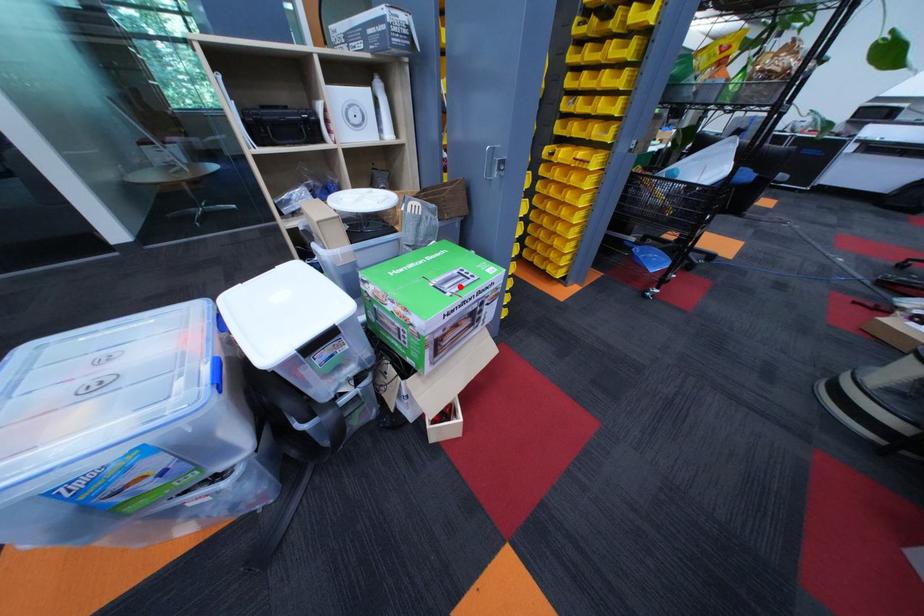
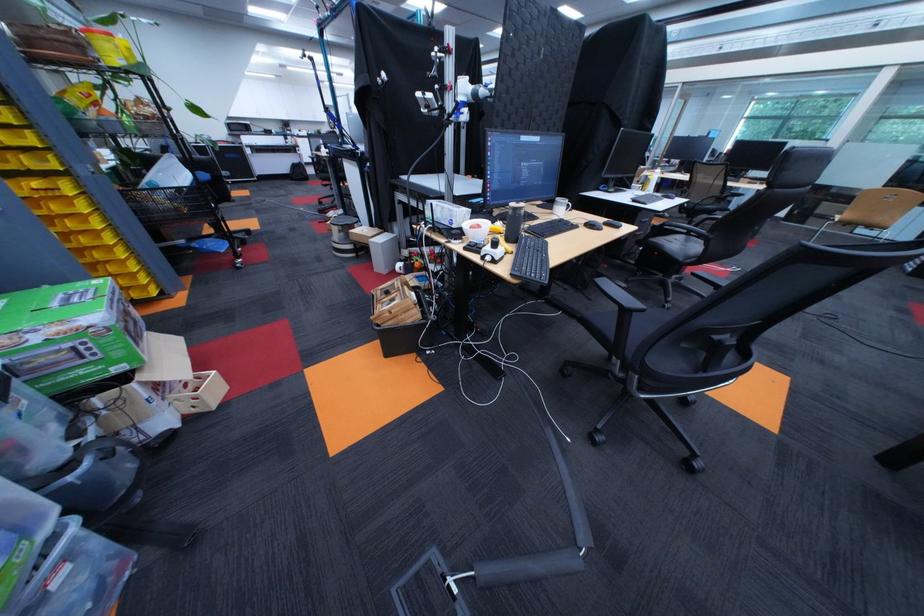
The point at the highlighted location is marked in the first image. Where is the corresponding point in the second image?

(89, 302)